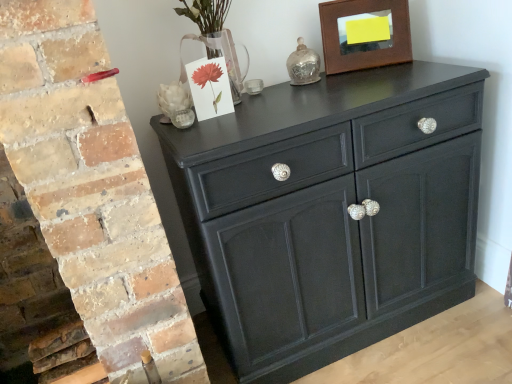
What is the approximate height of matte black cabinet at center?

30.08 inches.

The image size is (512, 384). What do you see at coordinates (367, 42) in the screenshot?
I see `brown wooden picture frame at upper right` at bounding box center [367, 42].

Where is `matte black cabinet at center`? Image resolution: width=512 pixels, height=384 pixels. matte black cabinet at center is located at coordinates click(331, 212).

How much distance is there between matte black cabinet at center and brown wooden picture frame at upper right?

A distance of 17.23 inches exists between matte black cabinet at center and brown wooden picture frame at upper right.

Considering the relative sizes of matte black cabinet at center and brown wooden picture frame at upper right in the image provided, is matte black cabinet at center taller than brown wooden picture frame at upper right?

Indeed, matte black cabinet at center has a greater height compared to brown wooden picture frame at upper right.

Does point (445, 131) come farther from viewer compared to point (366, 6)?

That is False.

Is matte black cabinet at center in front of or behind brown wooden picture frame at upper right in the image?

matte black cabinet at center is in front of brown wooden picture frame at upper right.

Between brown wooden picture frame at upper right and white matte sculpture at upper left, which one appears on the left side from the viewer's perspective?

white matte sculpture at upper left is more to the left.

Is brown wooden picture frame at upper right aimed at white matte sculpture at upper left?

No, brown wooden picture frame at upper right is not aimed at white matte sculpture at upper left.

In the image, is brown wooden picture frame at upper right positioned in front of or behind white matte sculpture at upper left?

In the image, brown wooden picture frame at upper right appears behind white matte sculpture at upper left.

From a real-world perspective, is white matte sculpture at upper left physically located above or below brown wooden picture frame at upper right?

white matte sculpture at upper left is below brown wooden picture frame at upper right.

Is white matte sculpture at upper left positioned before brown wooden picture frame at upper right?

Yes, it is in front of brown wooden picture frame at upper right.

Is white matte sculpture at upper left touching brown wooden picture frame at upper right?

They are not placed beside each other.

Which of these two, white matte sculpture at upper left or brown wooden picture frame at upper right, stands taller?

brown wooden picture frame at upper right.

From a real-world perspective, is brown wooden picture frame at upper right on matte black cabinet at center?

Indeed, from a real-world perspective, brown wooden picture frame at upper right stands above matte black cabinet at center.

Is brown wooden picture frame at upper right oriented towards matte black cabinet at center?

No.

Can you confirm if brown wooden picture frame at upper right is smaller than matte black cabinet at center?

Indeed, brown wooden picture frame at upper right has a smaller size compared to matte black cabinet at center.

From the image's perspective, relative to matte black cabinet at center, is brown wooden picture frame at upper right above or below?

From the image's perspective, brown wooden picture frame at upper right appears above matte black cabinet at center.

Looking at this image, from the image's perspective, would you say matte black cabinet at center is positioned over white matte sculpture at upper left?

Incorrect, from the image's perspective, matte black cabinet at center is lower than white matte sculpture at upper left.

Is matte black cabinet at center completely or partially outside of white matte sculpture at upper left?

Yes, matte black cabinet at center is located beyond the bounds of white matte sculpture at upper left.

From the picture: Does matte black cabinet at center turn towards white matte sculpture at upper left?

No.

Find the location of a particular element. flower that is above the matte black cabinet at center (from the image's perspective) is located at coordinates (173, 98).

Is white matte sculpture at upper left to the left or to the right of matte black cabinet at center in the image?

Based on their positions, white matte sculpture at upper left is located to the left of matte black cabinet at center.

Between white matte sculpture at upper left and matte black cabinet at center, which one has less height?

Standing shorter between the two is white matte sculpture at upper left.

From the image's perspective, is white matte sculpture at upper left under matte black cabinet at center?

No, from the image's perspective, white matte sculpture at upper left is not below matte black cabinet at center.

The width and height of the screenshot is (512, 384). Find the location of `the chest of drawers that appears in front of the brown wooden picture frame at upper right`. the chest of drawers that appears in front of the brown wooden picture frame at upper right is located at coordinates (331, 212).

The height and width of the screenshot is (384, 512). Identify the location of flower below the brown wooden picture frame at upper right (from the image's perspective). (173, 98).

Which object lies nearer to the anchor point white matte sculpture at upper left, brown wooden picture frame at upper right or matte black cabinet at center?

matte black cabinet at center lies closer to white matte sculpture at upper left than the other object.

Looking at the image, which one is located closer to brown wooden picture frame at upper right, white matte sculpture at upper left or matte black cabinet at center?

matte black cabinet at center.

Estimate the real-world distances between objects in this image. Which object is further from brown wooden picture frame at upper right, matte black cabinet at center or white matte sculpture at upper left?

Based on the image, white matte sculpture at upper left appears to be further to brown wooden picture frame at upper right.

When comparing their distances from white matte sculpture at upper left, does matte black cabinet at center or brown wooden picture frame at upper right seem closer?

matte black cabinet at center.

Looking at the image, which one is located closer to matte black cabinet at center, brown wooden picture frame at upper right or white matte sculpture at upper left?

Based on the image, brown wooden picture frame at upper right appears to be nearer to matte black cabinet at center.

Estimate the real-world distances between objects in this image. Which object is further from matte black cabinet at center, white matte sculpture at upper left or brown wooden picture frame at upper right?

white matte sculpture at upper left is further to matte black cabinet at center.

Find the location of a particular element. The height and width of the screenshot is (384, 512). chest of drawers between white matte sculpture at upper left and brown wooden picture frame at upper right from left to right is located at coordinates (331, 212).